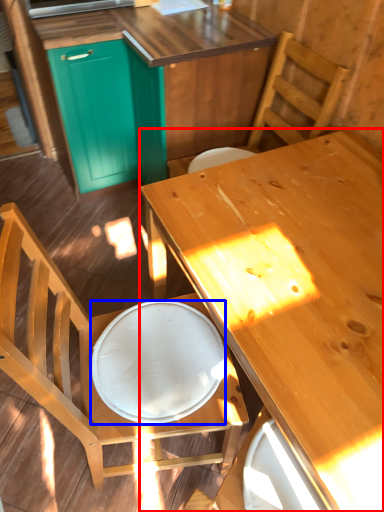
Question: Which of the following is the closest to the observer, desk (highlighted by a red box) or plate (highlighted by a blue box)?

Choices:
 (A) desk
 (B) plate

Answer: (A)